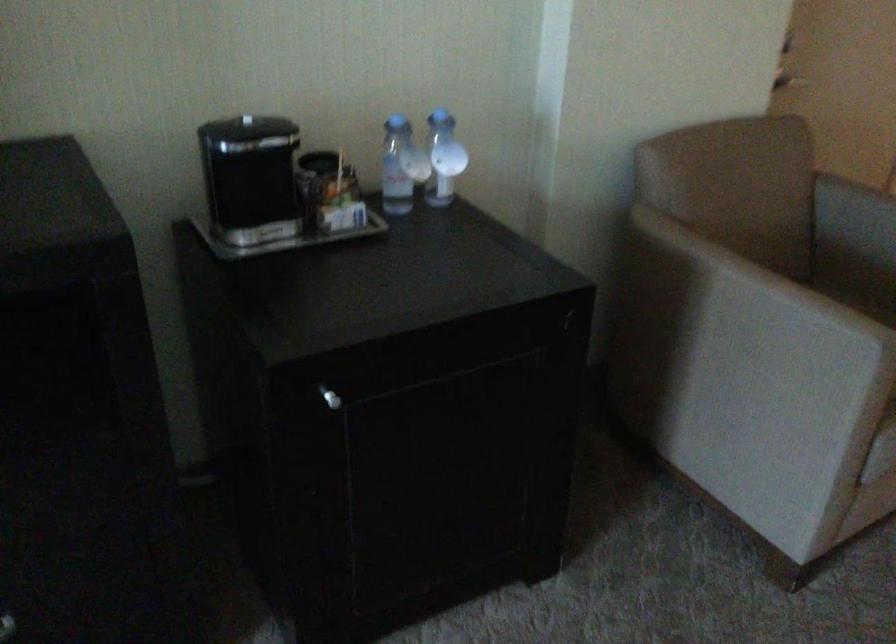
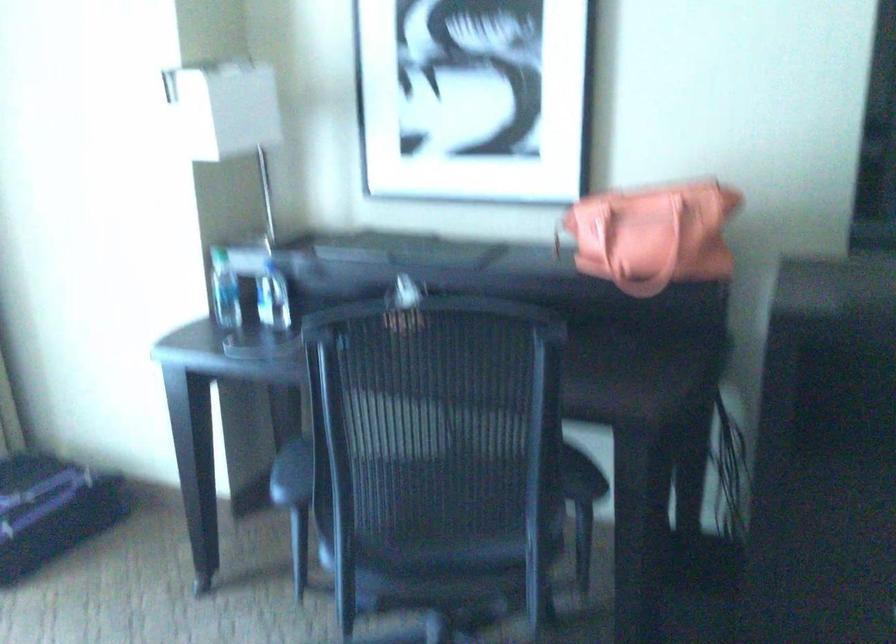
Question: The camera is either moving clockwise (left) or counter-clockwise (right) around the object. The first image is from the beginning of the video and the second image is from the end. Is the camera moving left or right when shooting the video?

Choices:
 (A) Left
 (B) Right

Answer: (B)